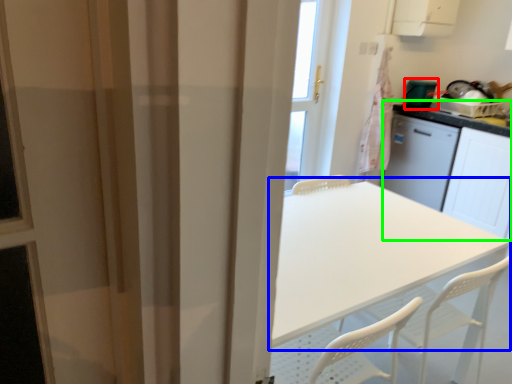
Question: Based on their relative distances, which object is farther from appliance (highlighted by a red box)? Choose from table (highlighted by a blue box) and counter (highlighted by a green box).

Choices:
 (A) table
 (B) counter

Answer: (A)